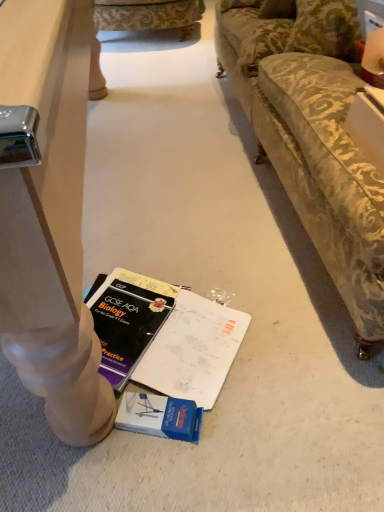
Question: Is point (322, 32) positioned closer to the camera than point (185, 26)?

Choices:
 (A) farther
 (B) closer

Answer: (B)

Question: Is velvet green pillow at upper right situated inside green floral fabric couch at upper center or outside?

Choices:
 (A) inside
 (B) outside

Answer: (B)

Question: Is velvet green pillow at upper right wider or thinner than green floral fabric couch at upper center?

Choices:
 (A) thin
 (B) wide

Answer: (A)

Question: From a real-world perspective, is green floral fabric couch at upper center positioned above or below velvet green pillow at upper right?

Choices:
 (A) below
 (B) above

Answer: (A)

Question: From their relative heights in the image, would you say green floral fabric couch at upper center is taller or shorter than velvet green pillow at upper right?

Choices:
 (A) tall
 (B) short

Answer: (A)

Question: Is green floral fabric couch at upper center spatially inside velvet green pillow at upper right, or outside of it?

Choices:
 (A) inside
 (B) outside

Answer: (B)

Question: Looking at their shapes, would you say green floral fabric couch at upper center is wider or thinner than velvet green pillow at upper right?

Choices:
 (A) thin
 (B) wide

Answer: (B)